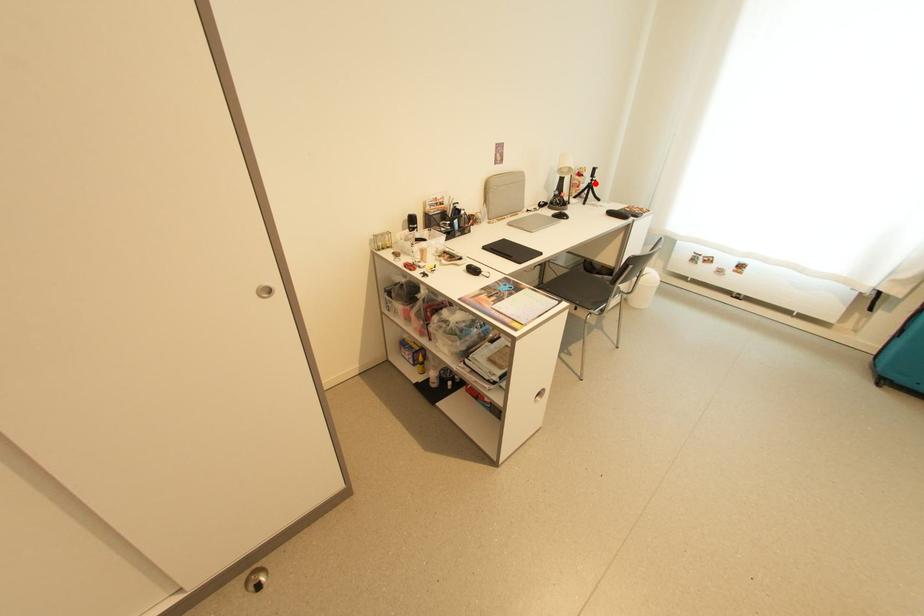
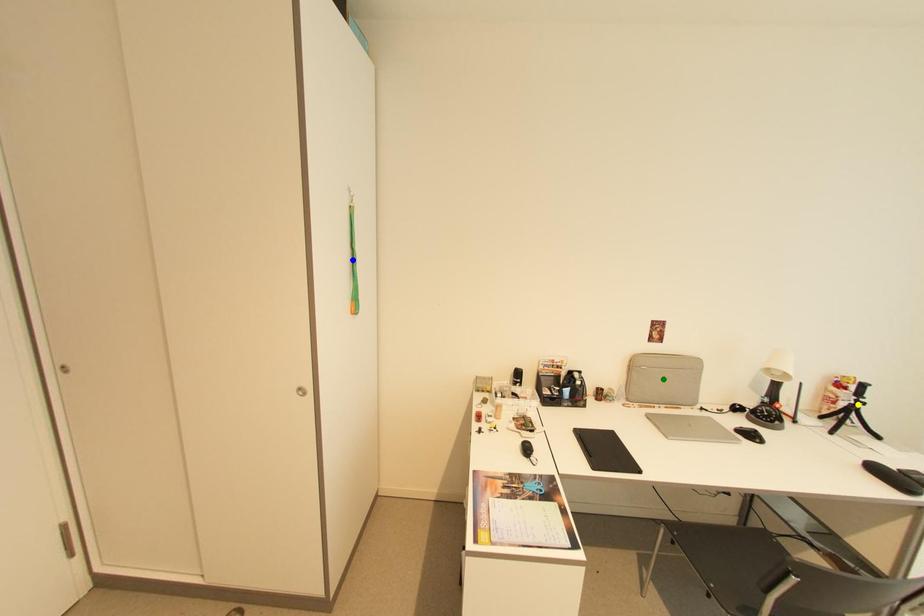
Question: I am providing you with two images of the same scene from different viewpoints. A red point is marked on the first image. You are given multiple points on the second image. Which point in image 2 is actually the same real-world point as the red point in image 1?

Choices:
 (A) blue point
 (B) green point
 (C) yellow point

Answer: (C)